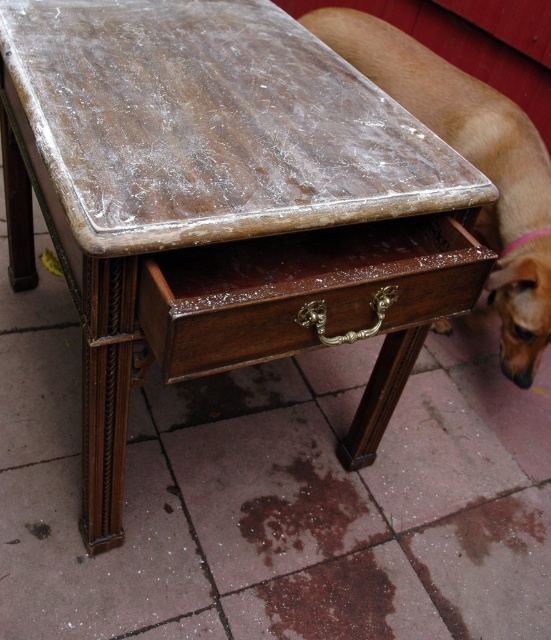
You are a guest at a house and see the shiny brown wood drawer at center and the brown fur dog at lower right. Which object is larger in size?

The shiny brown wood drawer at center is smaller than the brown fur dog at lower right, so the brown fur dog at lower right is larger in size.

You are a delivery person who needs to place a small package on the shiny brown wood drawer at center without disturbing the brown fur dog at lower right. Can you do this safely?

The shiny brown wood drawer at center and brown fur dog at lower right are 72.26 centimeters apart from each other. Since the distance is sufficient, you can place the package on the shiny brown wood drawer at center without disturbing the brown fur dog at lower right.